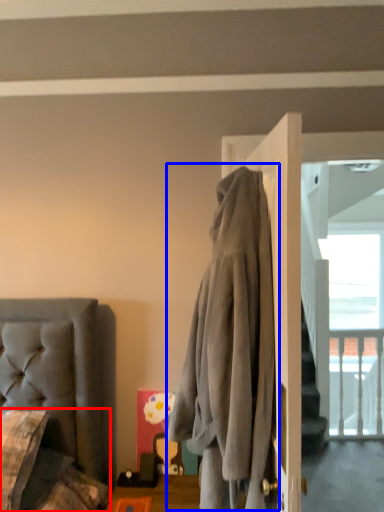
Question: Which of the following is the closest to the observer, couch (highlighted by a red box) or clothing (highlighted by a blue box)?

Choices:
 (A) couch
 (B) clothing

Answer: (B)